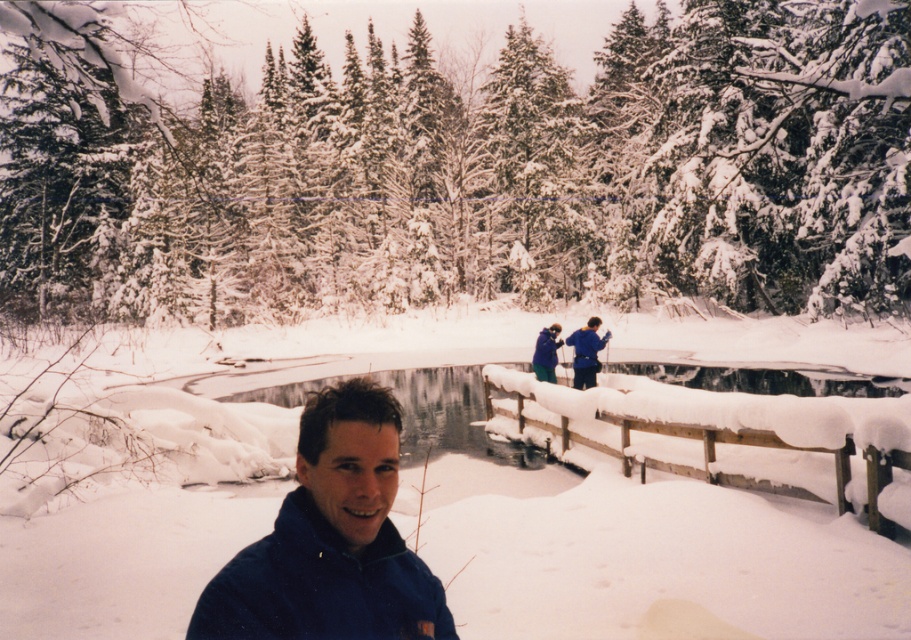
You are a photographer trying to capture a photo of both the blue fleece jacket at lower left and the blue fleece jacket at upper center in the winter forest scene. Which jacket should you focus on first if you want to include both in your shot without moving the camera?

You should focus on the blue fleece jacket at lower left first because it is positioned to the left of the blue fleece jacket at upper center, allowing both to be captured in the frame when centered appropriately.